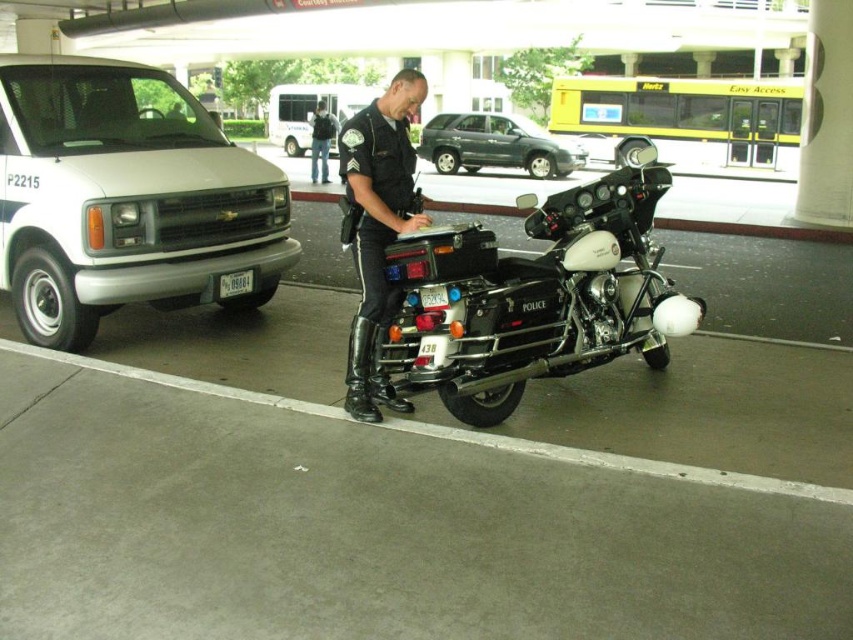
Does shiny black police motorcycle at center appear over dark blue jeans at center?

Incorrect, shiny black police motorcycle at center is not positioned above dark blue jeans at center.

Is shiny black police motorcycle at center positioned in front of dark blue jeans at center?

Yes, it is.

The height and width of the screenshot is (640, 853). I want to click on shiny black police motorcycle at center, so click(532, 298).

The height and width of the screenshot is (640, 853). What do you see at coordinates (125, 196) in the screenshot?
I see `white matte van at left` at bounding box center [125, 196].

Is point (67, 272) farther from camera compared to point (601, 163)?

No, (67, 272) is closer to viewer.

At what (x,y) coordinates should I click in order to perform the action: click on white matte van at left. Please return your answer as a coordinate pair (x, y). Looking at the image, I should click on (125, 196).

Can you confirm if black uniform at center is wider than metallic gray suv at center?

No, black uniform at center is not wider than metallic gray suv at center.

Does black uniform at center have a smaller size compared to metallic gray suv at center?

Incorrect, black uniform at center is not smaller in size than metallic gray suv at center.

Find the location of `black uniform at center`. black uniform at center is located at coordinates (376, 227).

Identify the location of black uniform at center. This screenshot has width=853, height=640. (376, 227).